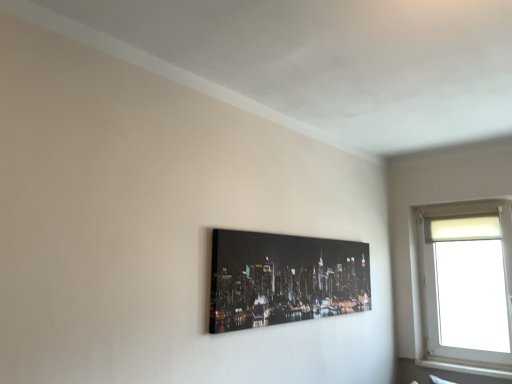
Describe the element at coordinates (466, 286) in the screenshot. I see `white plastic window at upper right` at that location.

This screenshot has width=512, height=384. I want to click on white plastic window at upper right, so click(466, 286).

Identify the location of black glossy canvas at center. The width and height of the screenshot is (512, 384). (284, 279).

Measure the distance between black glossy canvas at center and camera.

A distance of 1.86 meters exists between black glossy canvas at center and camera.

This screenshot has height=384, width=512. What do you see at coordinates (284, 279) in the screenshot?
I see `black glossy canvas at center` at bounding box center [284, 279].

Find the location of `white plastic window at upper right`. white plastic window at upper right is located at coordinates (466, 286).

From the picture: Considering the relative positions of black glossy canvas at center and white plastic window at upper right in the image provided, is black glossy canvas at center to the right of white plastic window at upper right from the viewer's perspective?

In fact, black glossy canvas at center is to the left of white plastic window at upper right.

Is black glossy canvas at center in front of or behind white plastic window at upper right in the image?

black glossy canvas at center is positioned closer to the viewer than white plastic window at upper right.

Which is nearer, [219,238] or [478,348]?

Clearly, point [219,238] is closer to the camera than point [478,348].

From the image's perspective, which one is positioned lower, black glossy canvas at center or white plastic window at upper right?

From the image's view, white plastic window at upper right is below.

Based on the photo, from a real-world perspective, is black glossy canvas at center under white plastic window at upper right?

No, from a real-world perspective, black glossy canvas at center is not below white plastic window at upper right.

Is black glossy canvas at center wider or thinner than white plastic window at upper right?

Considering their sizes, black glossy canvas at center looks slimmer than white plastic window at upper right.

From their relative heights in the image, would you say black glossy canvas at center is taller or shorter than white plastic window at upper right?

Clearly, black glossy canvas at center is shorter compared to white plastic window at upper right.

Considering the relative sizes of black glossy canvas at center and white plastic window at upper right in the image provided, is black glossy canvas at center smaller than white plastic window at upper right?

Yes.

Which is correct: black glossy canvas at center is inside white plastic window at upper right, or outside of it?

black glossy canvas at center exists outside the volume of white plastic window at upper right.

Is the surface of black glossy canvas at center in direct contact with white plastic window at upper right?

No.

Is black glossy canvas at center oriented away from white plastic window at upper right?

That's not correct — black glossy canvas at center is not looking away from white plastic window at upper right.

Measure the distance from black glossy canvas at center to white plastic window at upper right.

black glossy canvas at center and white plastic window at upper right are 3.52 feet apart.

I want to click on window that is behind the black glossy canvas at center, so click(x=466, y=286).

Would you say white plastic window at upper right is to the left or to the right of black glossy canvas at center in the picture?

In the image, white plastic window at upper right appears on the right side of black glossy canvas at center.

Who is more distant, white plastic window at upper right or black glossy canvas at center?

white plastic window at upper right.

Does point (492, 366) come behind point (302, 247)?

Yes.

From the image's perspective, does white plastic window at upper right appear lower than black glossy canvas at center?

Yes, from the image's perspective, white plastic window at upper right is below black glossy canvas at center.

From a real-world perspective, is white plastic window at upper right positioned under black glossy canvas at center based on gravity?

Correct, in the physical world, white plastic window at upper right is lower than black glossy canvas at center.

Is white plastic window at upper right wider than black glossy canvas at center?

Correct, the width of white plastic window at upper right exceeds that of black glossy canvas at center.

From their relative heights in the image, would you say white plastic window at upper right is taller or shorter than black glossy canvas at center?

In the image, white plastic window at upper right appears to be taller than black glossy canvas at center.

Considering the sizes of objects white plastic window at upper right and black glossy canvas at center in the image provided, who is smaller, white plastic window at upper right or black glossy canvas at center?

With smaller size is black glossy canvas at center.

Is white plastic window at upper right not inside black glossy canvas at center?

white plastic window at upper right lies outside black glossy canvas at center's area.

Consider the image. Is white plastic window at upper right positioned far away from black glossy canvas at center?

Yes, white plastic window at upper right is far from black glossy canvas at center.

Is white plastic window at upper right positioned with its back to black glossy canvas at center?

No, white plastic window at upper right is not facing away from black glossy canvas at center.

How many degrees apart are the facing directions of white plastic window at upper right and black glossy canvas at center?

90 degrees.

Where is `window below the black glossy canvas at center (from the image's perspective)`? window below the black glossy canvas at center (from the image's perspective) is located at coordinates (466, 286).

What are the coordinates of `picture frame located above the white plastic window at upper right (from the image's perspective)` in the screenshot? It's located at (284, 279).

Locate an element on the screen. This screenshot has height=384, width=512. picture frame above the white plastic window at upper right (from a real-world perspective) is located at coordinates (284, 279).